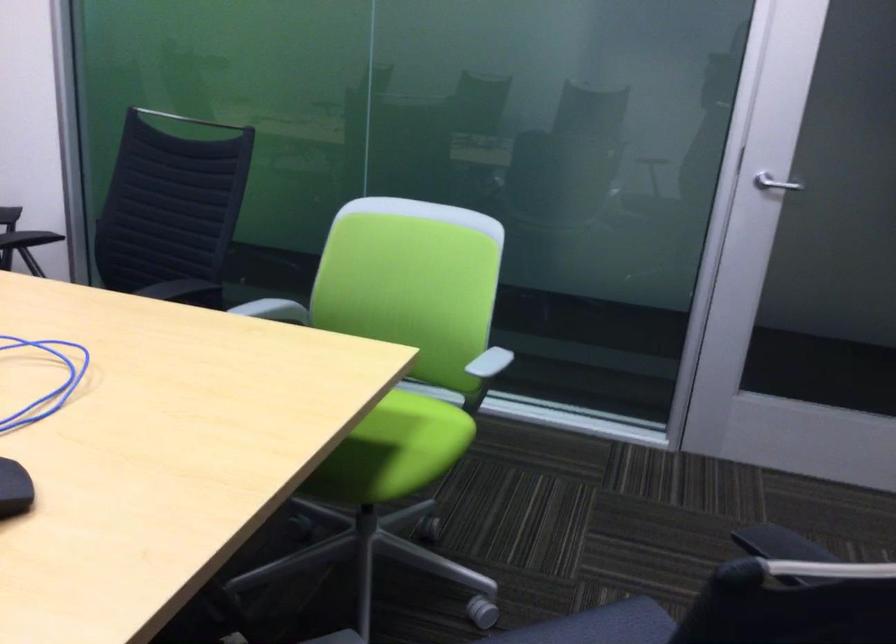
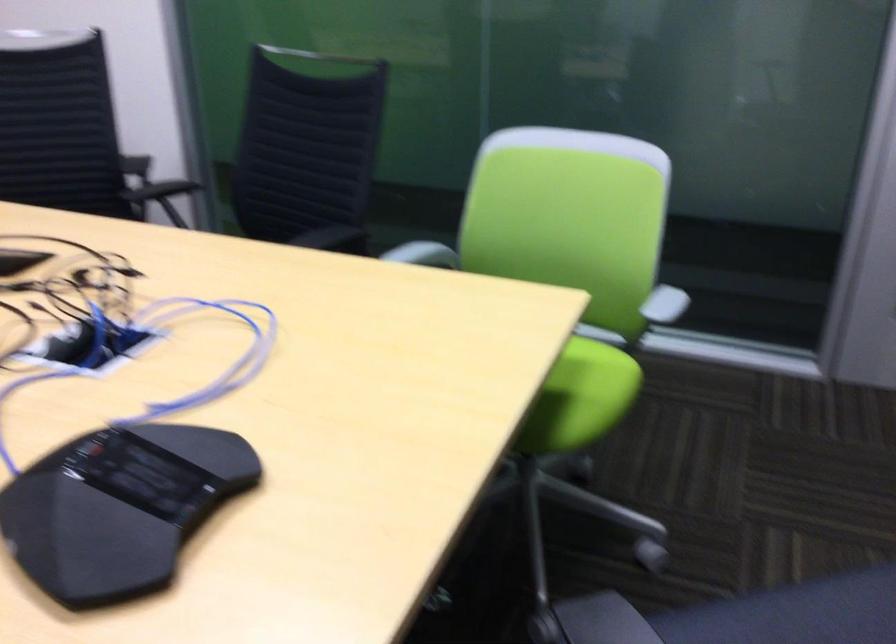
In the second image, find the point that corresponds to [426,447] in the first image.

(590, 392)